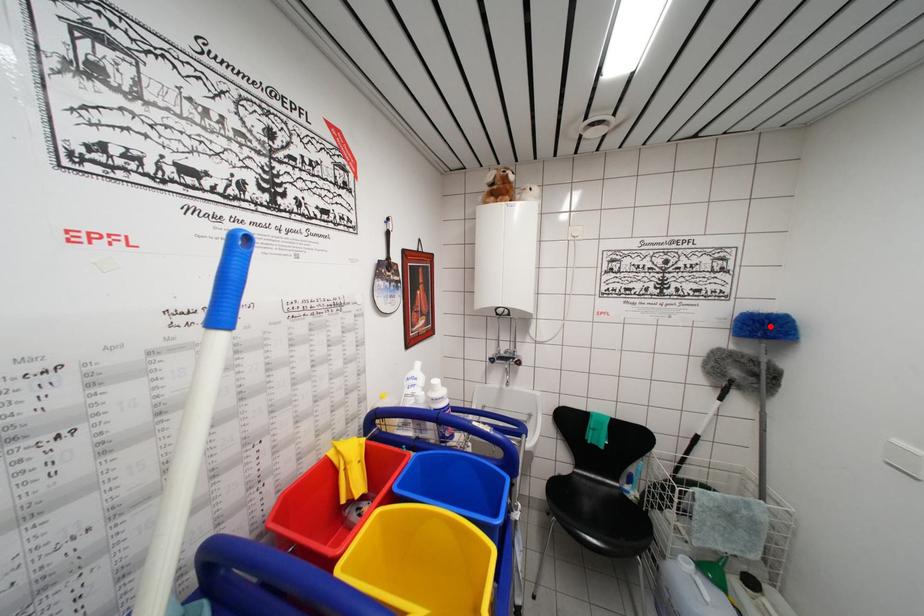
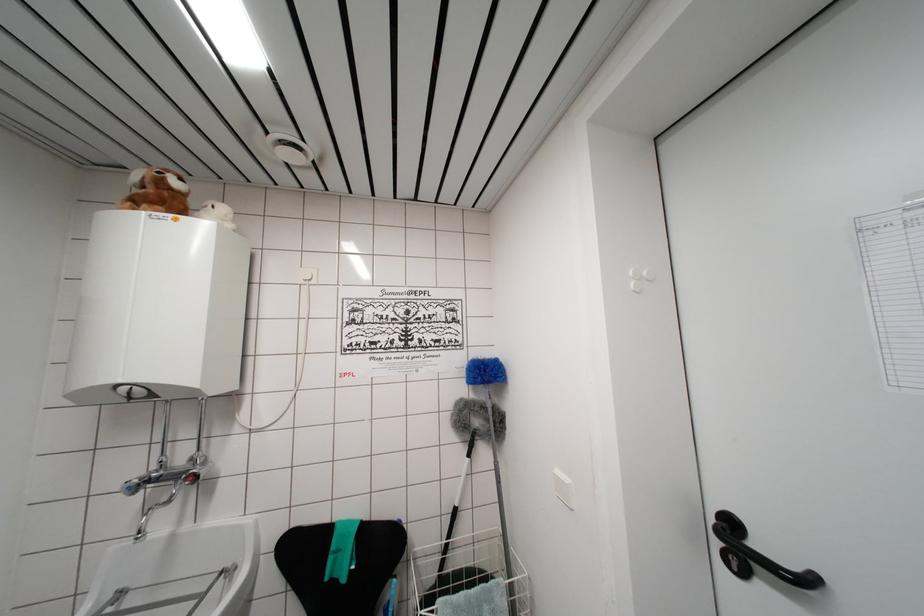
The point at the highlighted location is marked in the first image. Where is the corresponding point in the second image?

(484, 371)